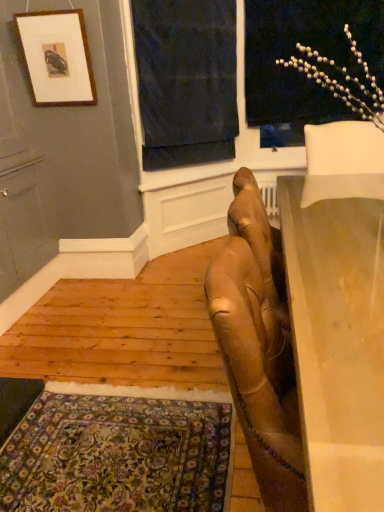
Question: Is smooth beige table at right outside matte wooden picture frame at upper left?

Choices:
 (A) no
 (B) yes

Answer: (B)

Question: From the image's perspective, is smooth beige table at right located beneath matte wooden picture frame at upper left?

Choices:
 (A) no
 (B) yes

Answer: (B)

Question: Does smooth beige table at right appear on the left side of matte wooden picture frame at upper left?

Choices:
 (A) yes
 (B) no

Answer: (B)

Question: Is smooth beige table at right further to the viewer compared to matte wooden picture frame at upper left?

Choices:
 (A) yes
 (B) no

Answer: (B)

Question: Does smooth beige table at right have a greater height compared to matte wooden picture frame at upper left?

Choices:
 (A) no
 (B) yes

Answer: (B)

Question: From a real-world perspective, is matte wooden picture frame at upper left above or below white matte floral arrangement at upper right?

Choices:
 (A) below
 (B) above

Answer: (B)

Question: From their relative heights in the image, would you say matte wooden picture frame at upper left is taller or shorter than white matte floral arrangement at upper right?

Choices:
 (A) short
 (B) tall

Answer: (A)

Question: Is matte wooden picture frame at upper left wider or thinner than white matte floral arrangement at upper right?

Choices:
 (A) wide
 (B) thin

Answer: (A)

Question: Considering the positions of matte wooden picture frame at upper left and white matte floral arrangement at upper right in the image, is matte wooden picture frame at upper left bigger or smaller than white matte floral arrangement at upper right?

Choices:
 (A) big
 (B) small

Answer: (B)

Question: From the image's perspective, is dark blue fabric at upper center located above or below white matte floral arrangement at upper right?

Choices:
 (A) above
 (B) below

Answer: (B)

Question: Is dark blue fabric at upper center taller or shorter than white matte floral arrangement at upper right?

Choices:
 (A) tall
 (B) short

Answer: (A)

Question: Choose the correct answer: Is dark blue fabric at upper center inside white matte floral arrangement at upper right or outside it?

Choices:
 (A) inside
 (B) outside

Answer: (B)

Question: Does point (168, 142) appear closer or farther from the camera than point (306, 51)?

Choices:
 (A) closer
 (B) farther

Answer: (B)

Question: Is carpeted rug at lower left inside the boundaries of smooth beige table at right, or outside?

Choices:
 (A) outside
 (B) inside

Answer: (A)

Question: Is carpeted rug at lower left taller or shorter than smooth beige table at right?

Choices:
 (A) short
 (B) tall

Answer: (A)